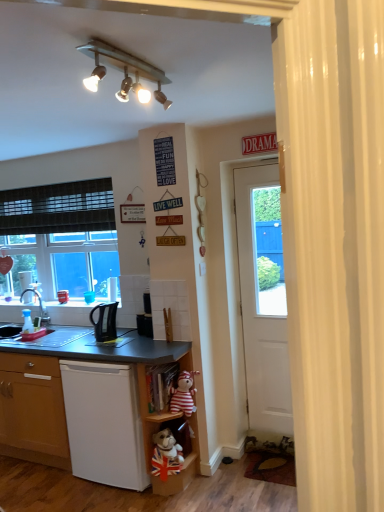
Question: Considering the relative positions of striped fabric teddy bear at lower center and wooden shelf at lower center, acting as the 1th shelf starting from the bottom, in the image provided, is striped fabric teddy bear at lower center to the right of wooden shelf at lower center, acting as the 1th shelf starting from the bottom, from the viewer's perspective?

Choices:
 (A) no
 (B) yes

Answer: (B)

Question: Is striped fabric teddy bear at lower center next to wooden shelf at lower center, the third shelf viewed from the top, and touching it?

Choices:
 (A) yes
 (B) no

Answer: (B)

Question: Could you tell me if striped fabric teddy bear at lower center is facing wooden shelf at lower center, acting as the 1th shelf starting from the bottom?

Choices:
 (A) no
 (B) yes

Answer: (A)

Question: Does striped fabric teddy bear at lower center have a smaller size compared to wooden shelf at lower center, the third shelf viewed from the top?

Choices:
 (A) yes
 (B) no

Answer: (A)

Question: From a real-world perspective, is striped fabric teddy bear at lower center on wooden shelf at lower center, the third shelf viewed from the top?

Choices:
 (A) yes
 (B) no

Answer: (A)

Question: From their relative heights in the image, would you say brushed metal faucet at left is taller or shorter than translucent plastic coffee cup at left?

Choices:
 (A) tall
 (B) short

Answer: (A)

Question: Which is correct: brushed metal faucet at left is inside translucent plastic coffee cup at left, or outside of it?

Choices:
 (A) outside
 (B) inside

Answer: (A)

Question: Is brushed metal faucet at left bigger or smaller than translucent plastic coffee cup at left?

Choices:
 (A) small
 (B) big

Answer: (B)

Question: Is brushed metal faucet at left wider or thinner than translucent plastic coffee cup at left?

Choices:
 (A) thin
 (B) wide

Answer: (B)

Question: Visually, is wooden shelf at lower center, the 2th shelf viewed from the top, positioned to the left or to the right of wooden bookshelf at lower center, which ranks as the 3th shelf in bottom-to-top order?

Choices:
 (A) left
 (B) right

Answer: (B)

Question: Which is correct: wooden shelf at lower center, arranged as the second shelf when ordered from the bottom, is inside wooden bookshelf at lower center, which appears as the 1th shelf when viewed from the top, or outside of it?

Choices:
 (A) outside
 (B) inside

Answer: (A)

Question: In terms of width, does wooden shelf at lower center, the 2th shelf viewed from the top, look wider or thinner when compared to wooden bookshelf at lower center, which appears as the 1th shelf when viewed from the top?

Choices:
 (A) wide
 (B) thin

Answer: (A)

Question: Does point (196, 438) appear closer or farther from the camera than point (145, 406)?

Choices:
 (A) farther
 (B) closer

Answer: (A)

Question: Considering the positions of point (8, 331) and point (107, 306), is point (8, 331) closer or farther from the camera than point (107, 306)?

Choices:
 (A) closer
 (B) farther

Answer: (B)

Question: From the image's perspective, is matte black sink at lower left, the 1th sink from the left, positioned above or below black plastic kettle at lower left?

Choices:
 (A) above
 (B) below

Answer: (B)